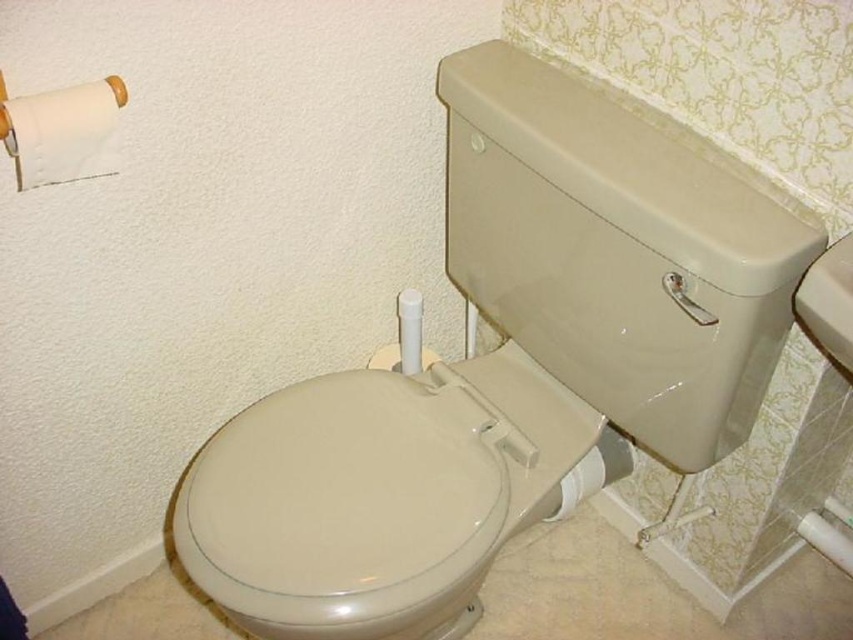
Is beige glossy toilet bowl at center to the right of white glossy toilet paper at lower right from the viewer's perspective?

No, beige glossy toilet bowl at center is not to the right of white glossy toilet paper at lower right.

Where is `beige glossy toilet bowl at center`? This screenshot has width=853, height=640. beige glossy toilet bowl at center is located at coordinates (506, 362).

I want to click on beige glossy toilet bowl at center, so click(506, 362).

Is the position of white matte toilet paper at upper left more distant than that of white glossy toilet paper at lower right?

No.

Can you confirm if white matte toilet paper at upper left is bigger than white glossy toilet paper at lower right?

No, white matte toilet paper at upper left is not bigger than white glossy toilet paper at lower right.

Identify the location of white matte toilet paper at upper left. The height and width of the screenshot is (640, 853). (62, 131).

Which is above, beige glossy toilet bowl at center or white matte toilet paper at upper left?

white matte toilet paper at upper left

At what (x,y) coordinates should I click in order to perform the action: click on beige glossy toilet bowl at center. Please return your answer as a coordinate pair (x, y). The image size is (853, 640). Looking at the image, I should click on (506, 362).

Describe the element at coordinates (506, 362) in the screenshot. Image resolution: width=853 pixels, height=640 pixels. I see `beige glossy toilet bowl at center` at that location.

Locate an element on the screen. The width and height of the screenshot is (853, 640). beige glossy toilet bowl at center is located at coordinates (506, 362).